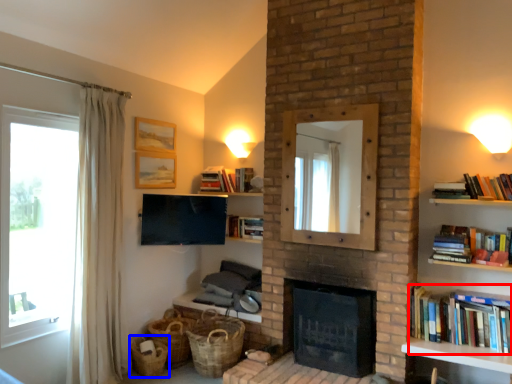
Question: Which object is further to the camera taking this photo, book (highlighted by a red box) or basket (highlighted by a blue box)?

Choices:
 (A) book
 (B) basket

Answer: (B)